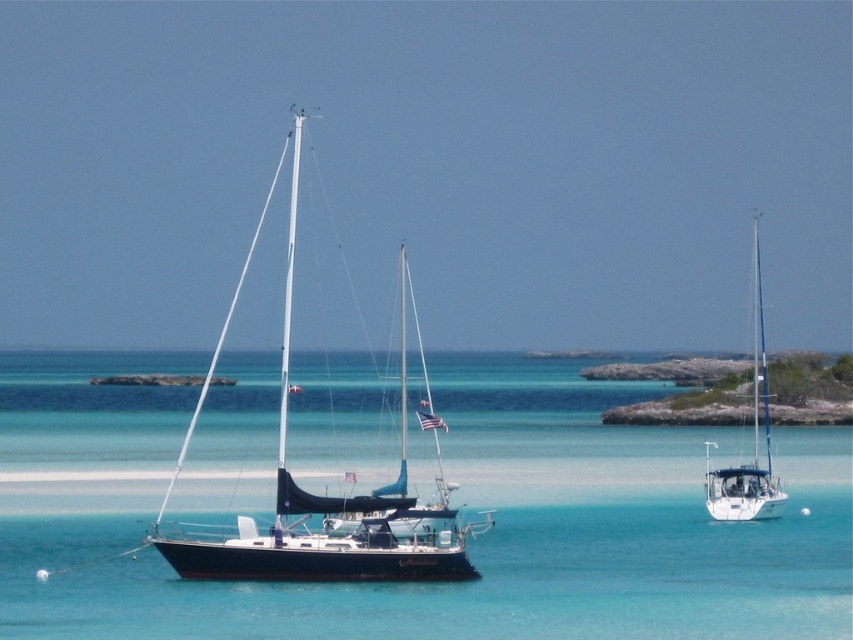
Question: Can you confirm if clear blue water at center is positioned to the left of white glossy sailboat at right?

Choices:
 (A) no
 (B) yes

Answer: (B)

Question: Is clear blue water at center thinner than white glossy sailboat at right?

Choices:
 (A) yes
 (B) no

Answer: (B)

Question: Which object appears closest to the camera in this image?

Choices:
 (A) clear blue water at center
 (B) white glossy sailboat at right

Answer: (A)

Question: Does clear blue water at center have a smaller size compared to white glossy sailboat at right?

Choices:
 (A) yes
 (B) no

Answer: (A)